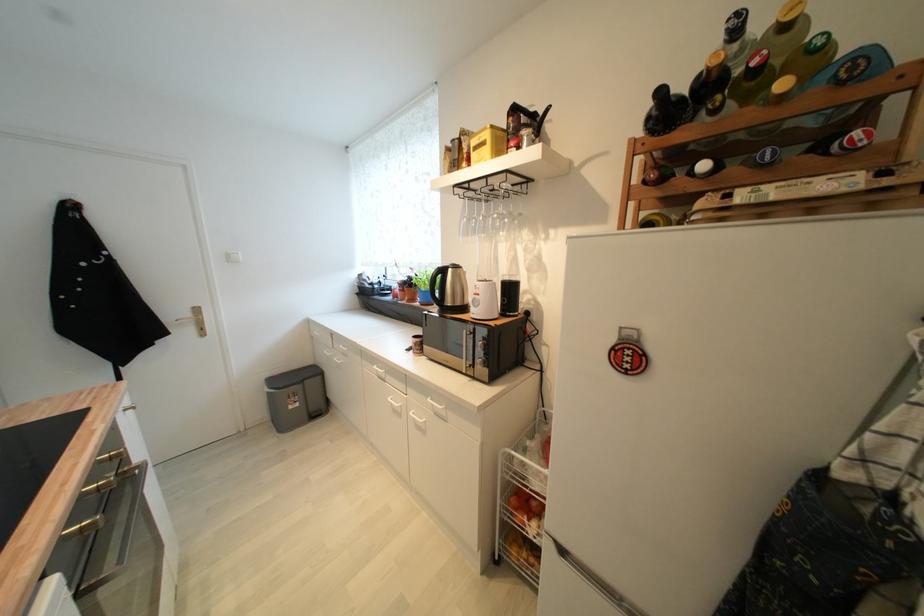
The width and height of the screenshot is (924, 616). Identify the location of gold door handle. (196, 320).